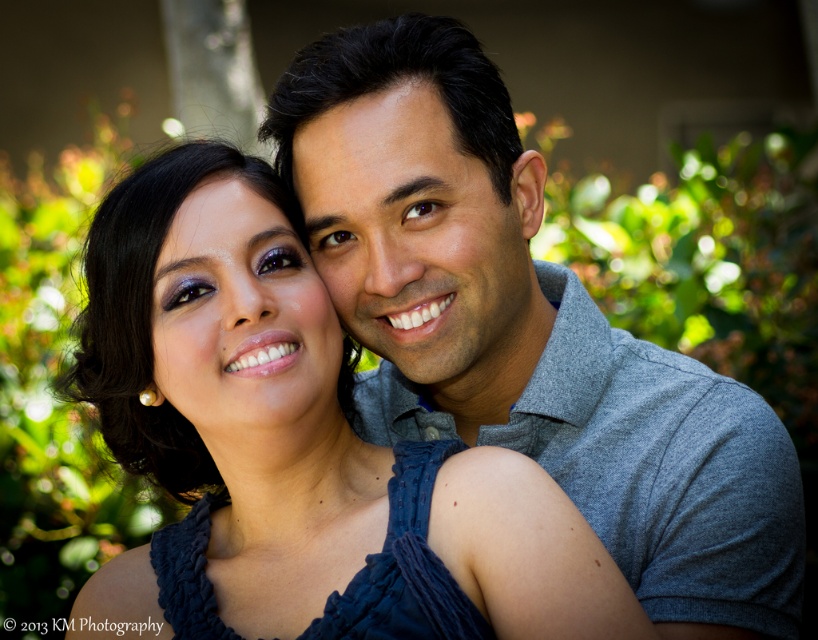
Is smooth skin face at center above matte purple eye shadow at center?

Indeed, smooth skin face at center is positioned over matte purple eye shadow at center.

Who is lower down, smooth skin face at center or matte purple eye shadow at center?

matte purple eye shadow at center is lower down.

Between point (423, 93) and point (279, 234), which one is positioned in front?

Point (423, 93)

The height and width of the screenshot is (640, 818). Find the location of `smooth skin face at center`. smooth skin face at center is located at coordinates (421, 241).

Is point (286, 356) farther from viewer compared to point (258, 323)?

Yes, point (286, 356) is behind point (258, 323).

Image resolution: width=818 pixels, height=640 pixels. What are the coordinates of `matte blue dress at center` in the screenshot? It's located at pos(295,445).

Where is `matte blue dress at center`? This screenshot has width=818, height=640. matte blue dress at center is located at coordinates (295, 445).

Who is taller, matte blue dress at center or smooth skin face at center?

matte blue dress at center is taller.

Can you confirm if matte blue dress at center is thinner than smooth skin face at center?

Incorrect, matte blue dress at center's width is not less than smooth skin face at center's.

Where is `matte blue dress at center`? This screenshot has width=818, height=640. matte blue dress at center is located at coordinates (295, 445).